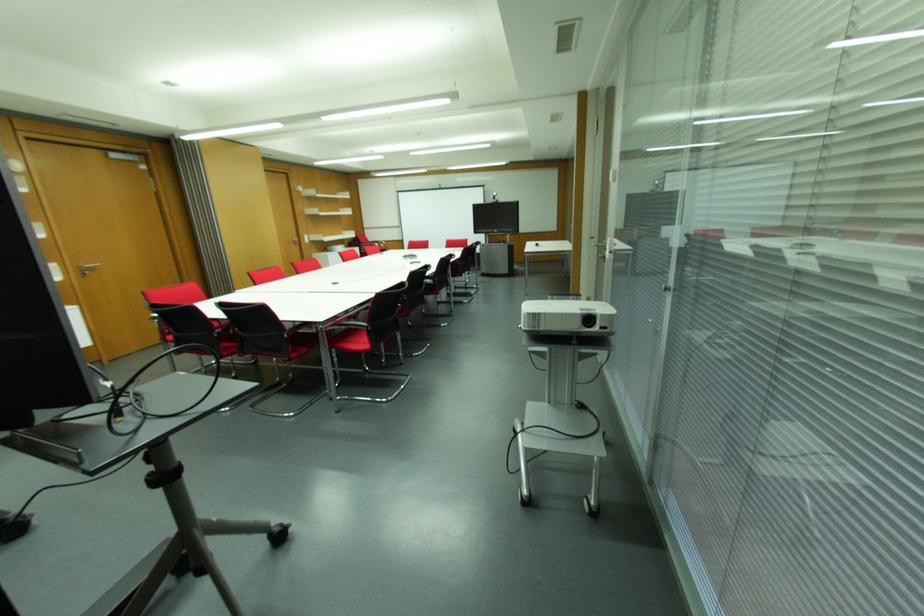
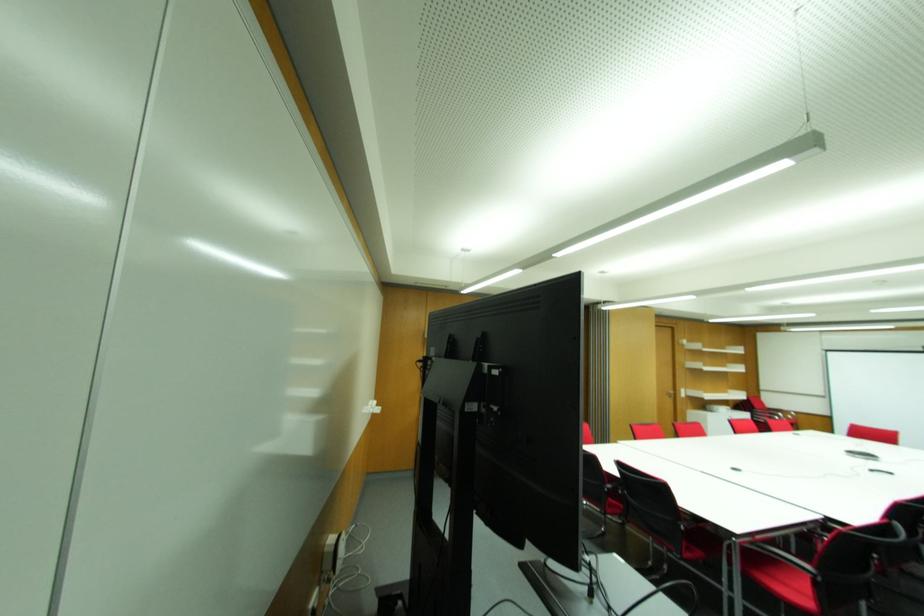
The point at [367,326] is marked in the first image. Where is the corresponding point in the second image?

(815, 576)